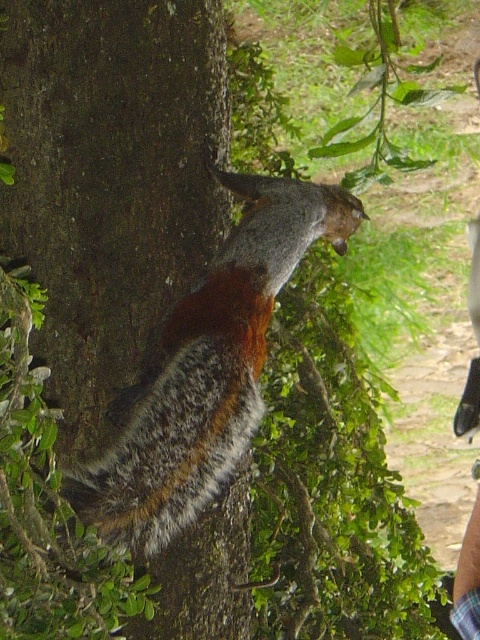
Question: Which point appears farthest from the camera in this image?

Choices:
 (A) (191, 346)
 (B) (184, 81)

Answer: (B)

Question: Which point appears farthest from the camera in this image?

Choices:
 (A) (223, 52)
 (B) (171, 349)

Answer: (A)

Question: Can you confirm if brown rough bark at center is wider than fuzzy brown fur at center?

Choices:
 (A) yes
 (B) no

Answer: (B)

Question: Can you confirm if brown rough bark at center is thinner than fuzzy brown fur at center?

Choices:
 (A) yes
 (B) no

Answer: (A)

Question: Does brown rough bark at center have a greater width compared to fuzzy brown fur at center?

Choices:
 (A) yes
 (B) no

Answer: (B)